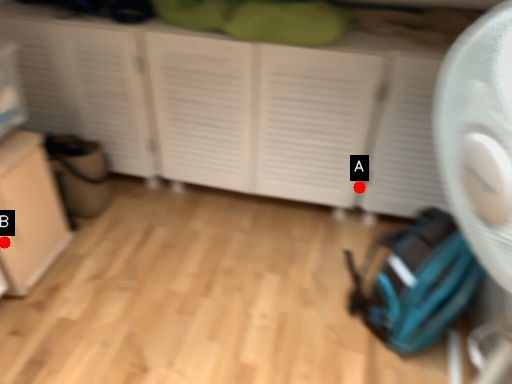
Question: Two points are circled on the image, labeled by A and B beside each circle. Which point is closer to the camera?

Choices:
 (A) A is closer
 (B) B is closer

Answer: (B)